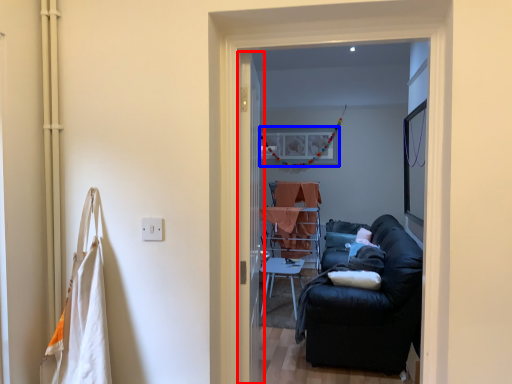
Question: Which object appears closest to the camera in this image, screen door (highlighted by a red box) or picture frame (highlighted by a blue box)?

Choices:
 (A) screen door
 (B) picture frame

Answer: (A)